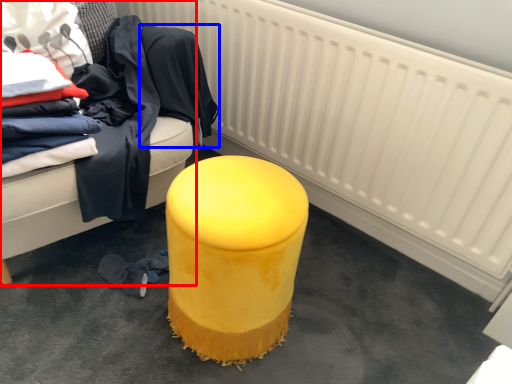
Question: Among these objects, which one is nearest to the camera, furniture (highlighted by a red box) or clothing (highlighted by a blue box)?

Choices:
 (A) furniture
 (B) clothing

Answer: (A)